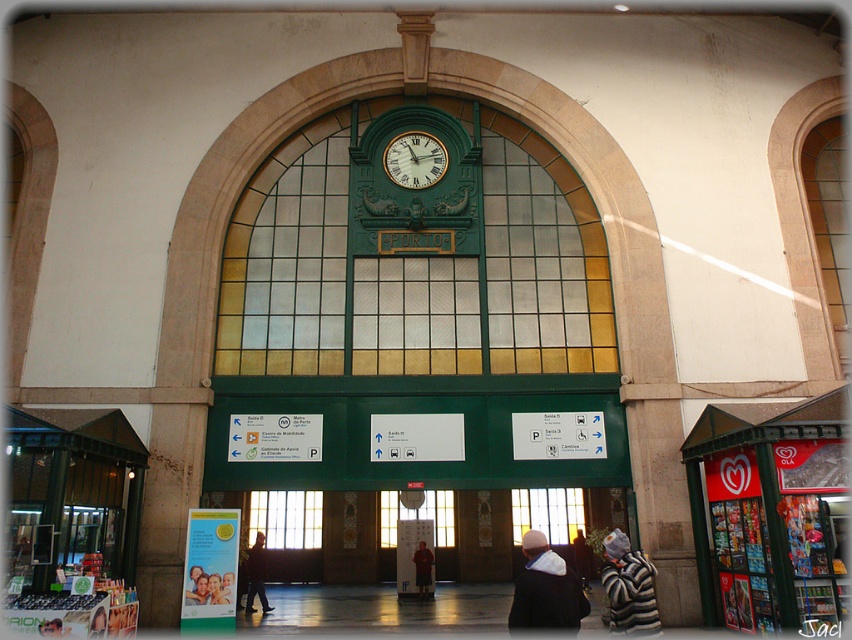
Does stained glass window at center appear on the left side of striped sweater at center?

No, stained glass window at center is not to the left of striped sweater at center.

Is the position of stained glass window at center more distant than that of striped sweater at center?

No, it is not.

Between point (540, 522) and point (419, 589), which one is positioned in front?

Point (419, 589) is more forward.

You are a GUI agent. You are given a task and a screenshot of the screen. Output one action in this format:
    pyautogui.click(x=<x>, y=<y>)
    Task: Click on the stained glass window at center
    
    Given the screenshot: What is the action you would take?
    pyautogui.click(x=547, y=513)

Does clear glass window at center have a lesser width compared to stained glass window at center?

No.

Which is behind, point (304, 541) or point (531, 525)?

The point (531, 525) is behind.

The height and width of the screenshot is (640, 852). I want to click on clear glass window at center, so click(x=286, y=516).

Where is `green glass window at center`? The image size is (852, 640). green glass window at center is located at coordinates (415, 257).

Is point (225, 307) closer to camera compared to point (418, 182)?

Yes, point (225, 307) is in front of point (418, 182).

This screenshot has height=640, width=852. Find the location of `green glass window at center`. green glass window at center is located at coordinates pos(415,257).